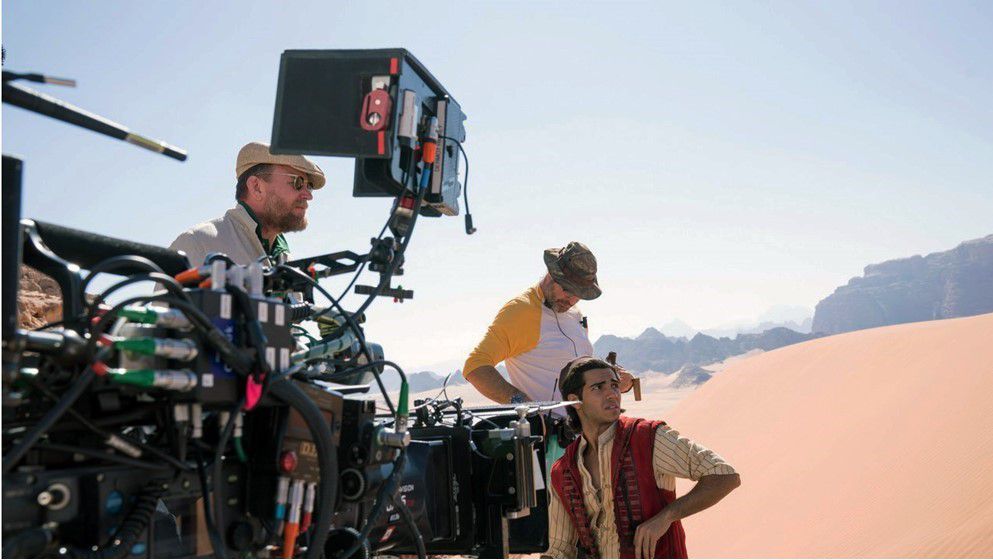
Find the location of a particular element. cords is located at coordinates click(147, 300), click(148, 273), click(144, 265).